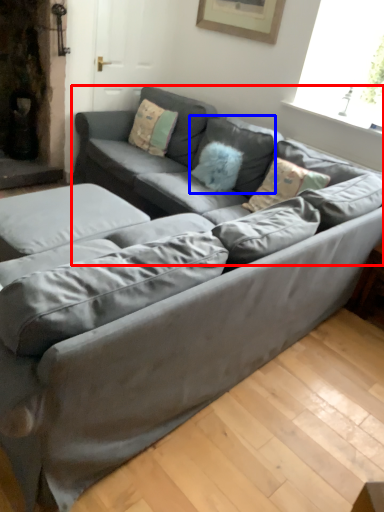
Question: Which object is further to the camera taking this photo, couch (highlighted by a red box) or pillow (highlighted by a blue box)?

Choices:
 (A) couch
 (B) pillow

Answer: (B)